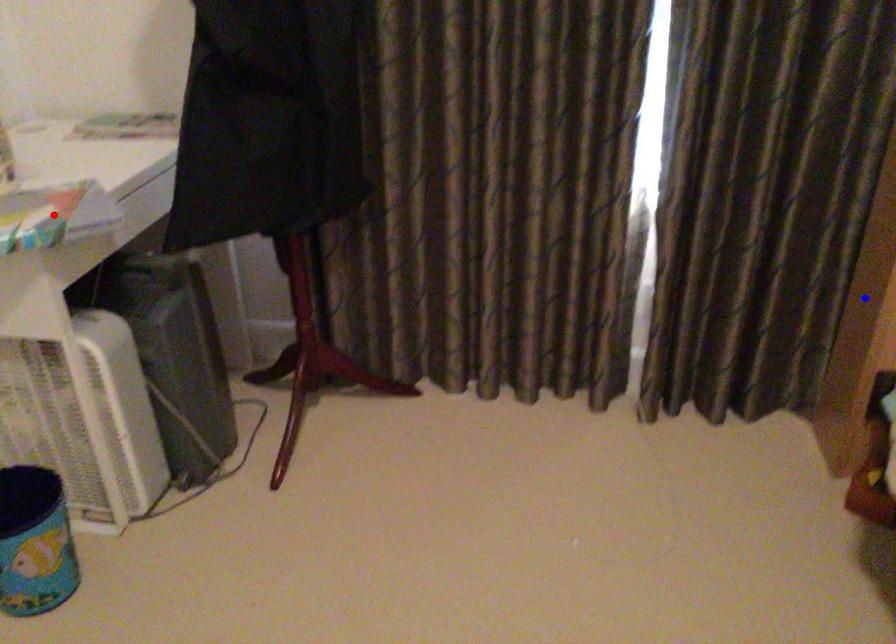
Question: In the image, two points are highlighted. Which point is nearer to the camera? Reply with the corresponding letter.

Choices:
 (A) blue point
 (B) red point

Answer: (B)